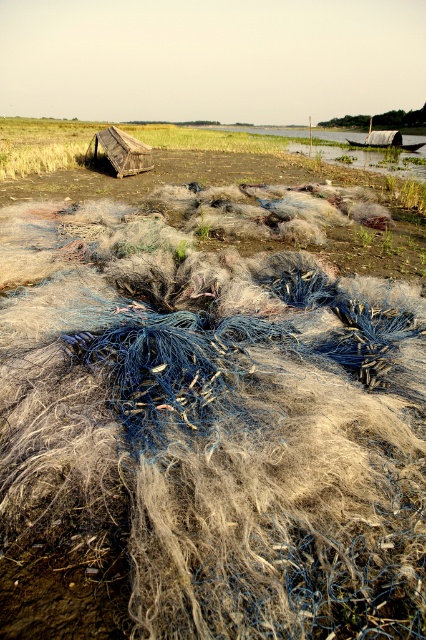
Does fuzzy blue net at center appear on the left side of rustic wooden hut at center?

No, fuzzy blue net at center is not to the left of rustic wooden hut at center.

Is fuzzy blue net at center positioned in front of rustic wooden hut at center?

Yes.

Between point (284, 588) and point (92, 148), which one is positioned behind?

The point (92, 148) is more distant.

This screenshot has height=640, width=426. In order to click on fuzzy blue net at center in this screenshot , I will do `click(218, 416)`.